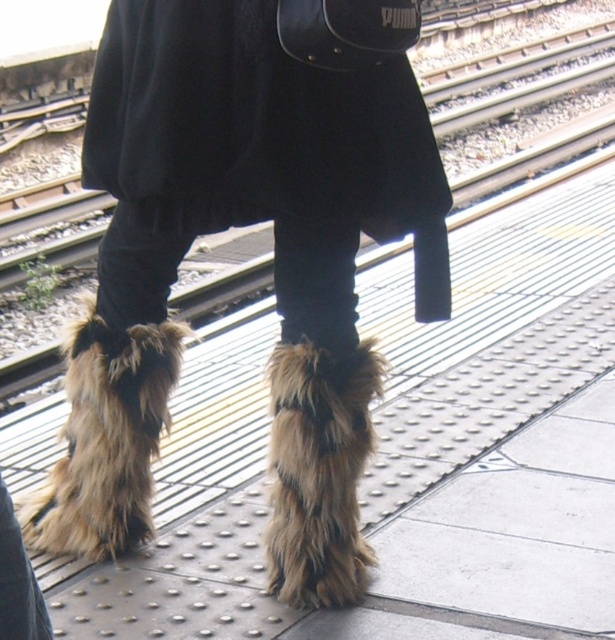
You are a photographer trying to capture a detailed shot of both the fuzzy fur boots at center and the fuzzy fur leg warmer at lower center. Given that your camera can focus on objects within a 5 inch range, will you be able to capture both clearly in the same shot?

The fuzzy fur boots at center is 6.58 inches from the fuzzy fur leg warmer at lower center. Since the camera can only focus within a 5 inch range, the distance between them exceeds the focus range. Therefore, you cannot capture both clearly in the same shot.

You are a photographer standing on the train platform. You want to take a picture of the fuzzy fur leg warmers at center. If your camera has a minimum focus distance of 3 meters, will you need to move closer or farther away to get a clear photo?

The fuzzy fur leg warmers at center is 2.94 meters from the viewer. Since the minimum focus distance is 3 meters, you need to move slightly farther away to ensure the camera can focus properly.